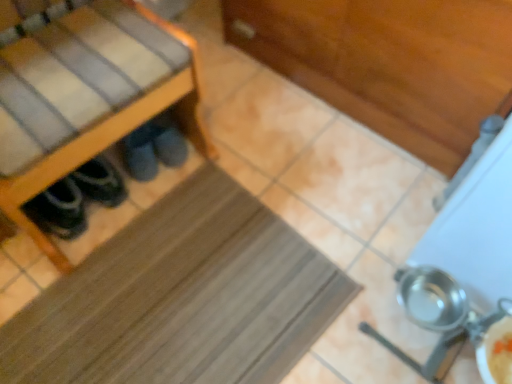
Question: Could you tell me if brown rubber mat at center is turned towards dark gray suede slippers at lower left?

Choices:
 (A) no
 (B) yes

Answer: (A)

Question: Considering the relative sizes of brown rubber mat at center and dark gray suede slippers at lower left in the image provided, is brown rubber mat at center wider than dark gray suede slippers at lower left?

Choices:
 (A) no
 (B) yes

Answer: (B)

Question: Would you say brown rubber mat at center is outside dark gray suede slippers at lower left?

Choices:
 (A) no
 (B) yes

Answer: (B)

Question: From the image's perspective, is brown rubber mat at center under dark gray suede slippers at lower left?

Choices:
 (A) no
 (B) yes

Answer: (B)

Question: Is the depth of brown rubber mat at center less than that of dark gray suede slippers at lower left?

Choices:
 (A) yes
 (B) no

Answer: (A)

Question: From the image's perspective, is brown rubber mat at center above dark gray suede slippers at lower left?

Choices:
 (A) no
 (B) yes

Answer: (A)

Question: From the image's perspective, is metallic silver pot at lower right below brown rubber mat at center?

Choices:
 (A) yes
 (B) no

Answer: (B)

Question: Is metallic silver pot at lower right thinner than brown rubber mat at center?

Choices:
 (A) yes
 (B) no

Answer: (A)

Question: Is metallic silver pot at lower right positioned behind brown rubber mat at center?

Choices:
 (A) no
 (B) yes

Answer: (A)

Question: Could brown rubber mat at center be considered to be inside metallic silver pot at lower right?

Choices:
 (A) yes
 (B) no

Answer: (B)

Question: Is metallic silver pot at lower right looking in the opposite direction of brown rubber mat at center?

Choices:
 (A) yes
 (B) no

Answer: (B)

Question: Is metallic silver pot at lower right at the right side of brown rubber mat at center?

Choices:
 (A) yes
 (B) no

Answer: (A)

Question: From the image's perspective, does dark gray suede slippers at lower left appear lower than metallic silver pot at lower right?

Choices:
 (A) no
 (B) yes

Answer: (A)